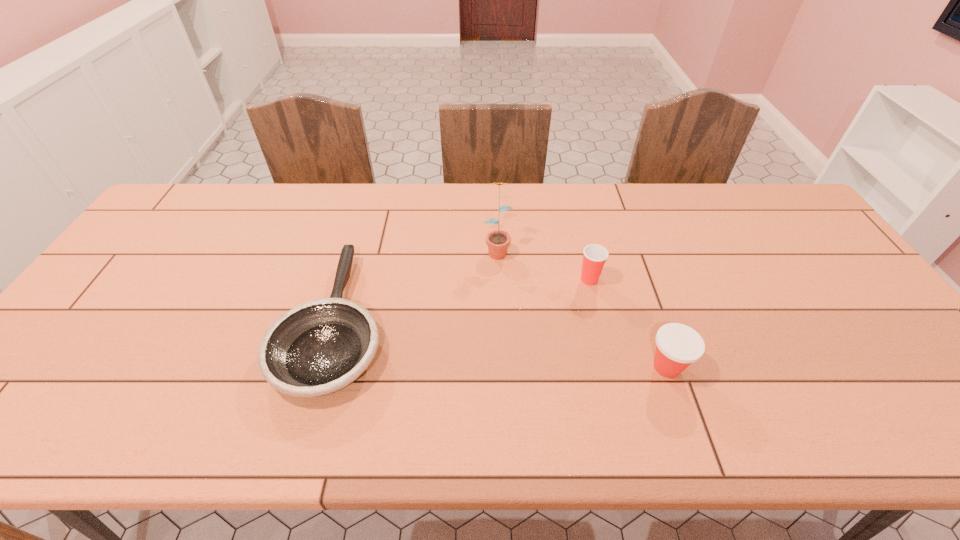
Locate an element on the screen. This screenshot has height=540, width=960. free space that satisfies the following two spatial constraints: 1. on the front side of the nearer Dixie cup; 2. on the right side of the farther Dixie cup is located at coordinates (611, 367).

Identify the location of free space that satisfies the following two spatial constraints: 1. on the flower of the tallest object; 2. on the right side of the farther Dixie cup. (498, 280).

The image size is (960, 540). What are the coordinates of `blank area in the image that satisfies the following two spatial constraints: 1. on the flower of the nearer Dixie cup; 2. on the left side of the third object from right to left` in the screenshot? It's located at (501, 367).

Find the location of `free spot that satisfies the following two spatial constraints: 1. on the handle side of the farther Dixie cup; 2. on the left side of the leftmost object`. free spot that satisfies the following two spatial constraints: 1. on the handle side of the farther Dixie cup; 2. on the left side of the leftmost object is located at coordinates (348, 280).

Locate an element on the screen. This screenshot has height=540, width=960. free region that satisfies the following two spatial constraints: 1. on the flower of the left Dixie cup; 2. on the right side of the tallest object is located at coordinates (498, 280).